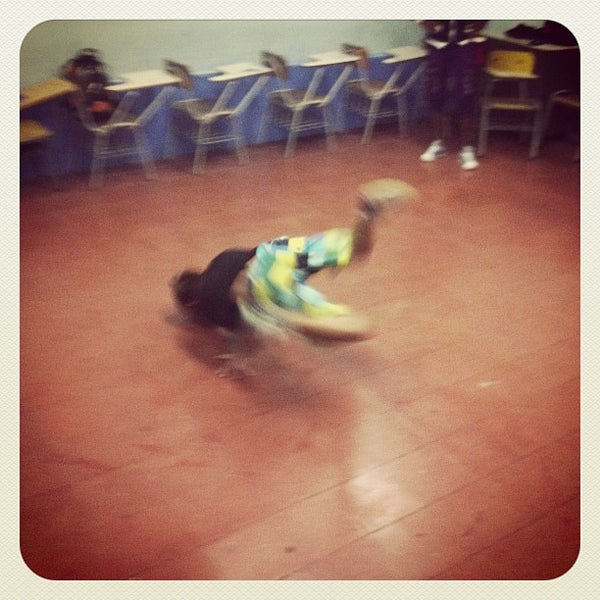
Locate an element on the screen. Image resolution: width=600 pixels, height=600 pixels. image frame outer corners is located at coordinates (1, 597), (598, 596), (599, 1), (1, 0).